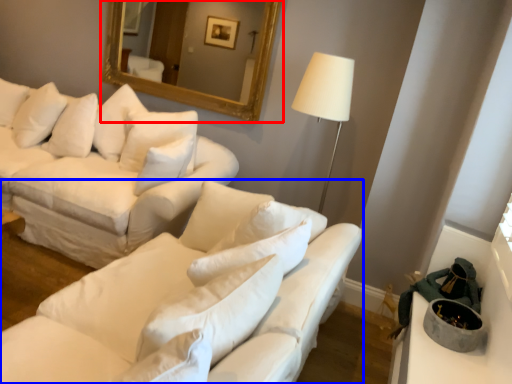
Question: Which of the following is the closest to the observer, mirror (highlighted by a red box) or studio couch (highlighted by a blue box)?

Choices:
 (A) mirror
 (B) studio couch

Answer: (B)